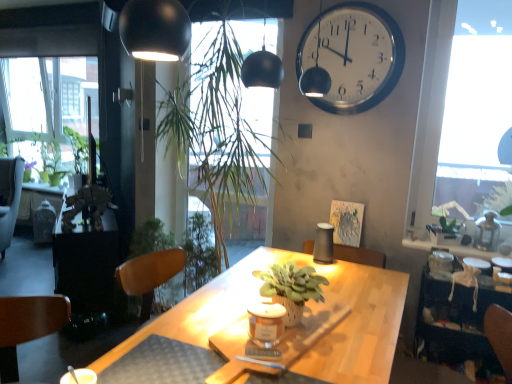
Identify the location of free spot in front of matte glass candle at center. Image resolution: width=512 pixels, height=384 pixels. (254, 364).